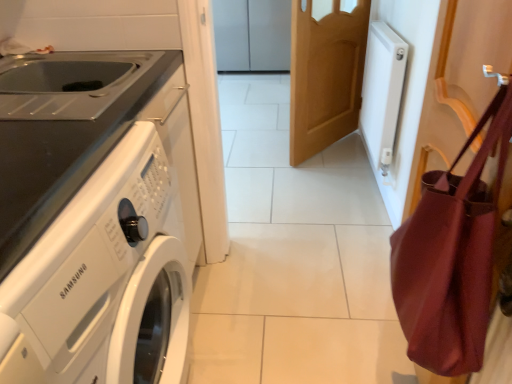
Identify the location of white glossy washing machine at left. point(104,280).

In order to face matte burgundy shoulder bag at right, should I rotate leftwards or rightwards?

A 23.721 degree turn to the right will do.

Find the location of a particular element. white glossy washing machine at left is located at coordinates (104, 280).

Is matte burgundy shoulder bag at right bigger or smaller than white glossy washing machine at left?

matte burgundy shoulder bag at right is smaller than white glossy washing machine at left.

Does point (431, 192) come behind point (125, 135)?

No, (431, 192) is in front of (125, 135).

Is matte burgundy shoulder bag at right beside white glossy washing machine at left?

There is a gap between matte burgundy shoulder bag at right and white glossy washing machine at left.

From the image's perspective, is light brown wooden door at center located beneath white glossy cabinet at upper center?

Yes, from the image's perspective, light brown wooden door at center is below white glossy cabinet at upper center.

How different are the orientations of light brown wooden door at center and white glossy cabinet at upper center in degrees?

127 degrees.

Does light brown wooden door at center have a smaller size compared to white glossy cabinet at upper center?

Yes.

Is light brown wooden door at center taller than white glossy cabinet at upper center?

Indeed, light brown wooden door at center has a greater height compared to white glossy cabinet at upper center.

In terms of height, does white glossy washing machine at left look taller or shorter compared to metallic stainless steel sink at left?

In the image, white glossy washing machine at left appears to be taller than metallic stainless steel sink at left.

Does white glossy washing machine at left have a lesser width compared to metallic stainless steel sink at left?

No.

Which object is closer to the camera, white glossy washing machine at left or metallic stainless steel sink at left?

white glossy washing machine at left is in front.

Image resolution: width=512 pixels, height=384 pixels. What are the coordinates of `washing machine below the metallic stainless steel sink at left (from a real-world perspective)` in the screenshot? It's located at (104, 280).

Can you tell me how much matte burgundy shoulder bag at right and light brown wooden door at center differ in facing direction?

There is a 37.4-degree angle between the facing directions of matte burgundy shoulder bag at right and light brown wooden door at center.

Are matte burgundy shoulder bag at right and light brown wooden door at center located far from each other?

Yes.

Is matte burgundy shoulder bag at right located outside light brown wooden door at center?

matte burgundy shoulder bag at right lies outside light brown wooden door at center's area.

Is matte burgundy shoulder bag at right facing away from light brown wooden door at center?

That's not correct — matte burgundy shoulder bag at right is not looking away from light brown wooden door at center.

Is metallic stainless steel sink at left positioned far away from white glossy washing machine at left?

No, there isn't a large distance between metallic stainless steel sink at left and white glossy washing machine at left.

Considering the sizes of objects metallic stainless steel sink at left and white glossy washing machine at left in the image provided, who is thinner, metallic stainless steel sink at left or white glossy washing machine at left?

metallic stainless steel sink at left.

From the image's perspective, would you say metallic stainless steel sink at left is shown under white glossy washing machine at left?

No, from the image's perspective, metallic stainless steel sink at left is not beneath white glossy washing machine at left.

Considering their positions, is metallic stainless steel sink at left located in front of or behind white glossy washing machine at left?

Visually, metallic stainless steel sink at left is located behind white glossy washing machine at left.

In the scene shown: Does metallic stainless steel sink at left have a lesser height compared to light brown wooden door at center?

Yes, metallic stainless steel sink at left is shorter than light brown wooden door at center.

Who is bigger, metallic stainless steel sink at left or light brown wooden door at center?

Bigger between the two is light brown wooden door at center.

From the image's perspective, which is above, metallic stainless steel sink at left or light brown wooden door at center?

light brown wooden door at center.

Do you think metallic stainless steel sink at left is within light brown wooden door at center, or outside of it?

metallic stainless steel sink at left is located beyond the bounds of light brown wooden door at center.

Considering their positions, is white glossy washing machine at left located in front of or behind white glossy cabinet at upper center?

Visually, white glossy washing machine at left is located in front of white glossy cabinet at upper center.

In the scene shown: Is white glossy washing machine at left placed right next to white glossy cabinet at upper center?

They are not placed beside each other.

From the image's perspective, is white glossy washing machine at left positioned above or below white glossy cabinet at upper center?

Based on their image positions, white glossy washing machine at left is located beneath white glossy cabinet at upper center.

Where is `washing machine that is on the left side of matte burgundy shoulder bag at right`? washing machine that is on the left side of matte burgundy shoulder bag at right is located at coordinates (104, 280).

Identify the location of door in front of the white glossy cabinet at upper center. (325, 75).

When comparing their distances from matte burgundy shoulder bag at right, does white glossy washing machine at left or light brown wooden door at center seem further?

The object further to matte burgundy shoulder bag at right is light brown wooden door at center.

In the scene shown: Looking at the image, which one is located further to white glossy washing machine at left, metallic stainless steel sink at left or matte burgundy shoulder bag at right?

matte burgundy shoulder bag at right lies further to white glossy washing machine at left than the other object.

Looking at the image, which one is located closer to metallic stainless steel sink at left, white glossy cabinet at upper center or light brown wooden door at center?

light brown wooden door at center lies closer to metallic stainless steel sink at left than the other object.

Based on their spatial positions, is matte burgundy shoulder bag at right or white glossy washing machine at left further from white glossy cabinet at upper center?

matte burgundy shoulder bag at right is positioned further to the anchor white glossy cabinet at upper center.

When comparing their distances from metallic stainless steel sink at left, does white glossy cabinet at upper center or matte burgundy shoulder bag at right seem further?

white glossy cabinet at upper center is positioned further to the anchor metallic stainless steel sink at left.

Based on their spatial positions, is light brown wooden door at center or white glossy washing machine at left closer to white glossy cabinet at upper center?

light brown wooden door at center.

Which object lies nearer to the anchor point matte burgundy shoulder bag at right, light brown wooden door at center or metallic stainless steel sink at left?

Among the two, metallic stainless steel sink at left is located nearer to matte burgundy shoulder bag at right.

Based on their spatial positions, is matte burgundy shoulder bag at right or white glossy cabinet at upper center further from metallic stainless steel sink at left?

The object further to metallic stainless steel sink at left is white glossy cabinet at upper center.

Locate an element on the screen. The width and height of the screenshot is (512, 384). door between matte burgundy shoulder bag at right and white glossy cabinet at upper center along the z-axis is located at coordinates (325, 75).

Identify the location of door between white glossy washing machine at left and white glossy cabinet at upper center along the z-axis. (325, 75).

Identify the location of sink positioned between matte burgundy shoulder bag at right and white glossy cabinet at upper center from near to far. (67, 83).

The height and width of the screenshot is (384, 512). Identify the location of sink between matte burgundy shoulder bag at right and light brown wooden door at center from front to back. (67, 83).